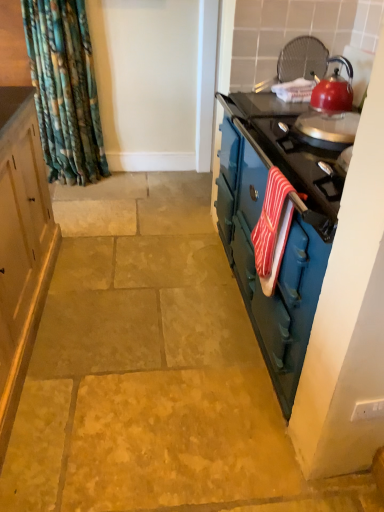
Question: From the image's perspective, is red striped towel at right located beneath shiny red kettle at upper right?

Choices:
 (A) yes
 (B) no

Answer: (A)

Question: Does red striped towel at right have a greater height compared to shiny red kettle at upper right?

Choices:
 (A) no
 (B) yes

Answer: (B)

Question: Could you tell me if red striped towel at right is facing shiny red kettle at upper right?

Choices:
 (A) no
 (B) yes

Answer: (A)

Question: Does red striped towel at right have a lesser height compared to shiny red kettle at upper right?

Choices:
 (A) no
 (B) yes

Answer: (A)

Question: From a real-world perspective, is red striped towel at right physically above shiny red kettle at upper right?

Choices:
 (A) yes
 (B) no

Answer: (B)

Question: In terms of size, does teal glossy dresser at right appear bigger or smaller than shiny red kettle at upper right?

Choices:
 (A) small
 (B) big

Answer: (B)

Question: Visually, is teal glossy dresser at right positioned to the left or to the right of shiny red kettle at upper right?

Choices:
 (A) right
 (B) left

Answer: (B)

Question: From a real-world perspective, is teal glossy dresser at right above or below shiny red kettle at upper right?

Choices:
 (A) below
 (B) above

Answer: (A)

Question: Is point (256, 321) closer or farther from the camera than point (327, 98)?

Choices:
 (A) closer
 (B) farther

Answer: (A)

Question: Is shiny red kettle at upper right in front of or behind teal glossy dresser at right in the image?

Choices:
 (A) front
 (B) behind

Answer: (B)

Question: Is point (316, 106) closer or farther from the camera than point (223, 241)?

Choices:
 (A) farther
 (B) closer

Answer: (B)

Question: Is shiny red kettle at upper right taller or shorter than teal glossy dresser at right?

Choices:
 (A) tall
 (B) short

Answer: (B)

Question: Is shiny red kettle at upper right spatially inside teal glossy dresser at right, or outside of it?

Choices:
 (A) outside
 (B) inside

Answer: (A)

Question: Does point (251, 265) appear closer or farther from the camera than point (274, 187)?

Choices:
 (A) farther
 (B) closer

Answer: (A)

Question: In the image, is teal glossy dresser at right positioned in front of or behind red striped towel at right?

Choices:
 (A) behind
 (B) front

Answer: (B)